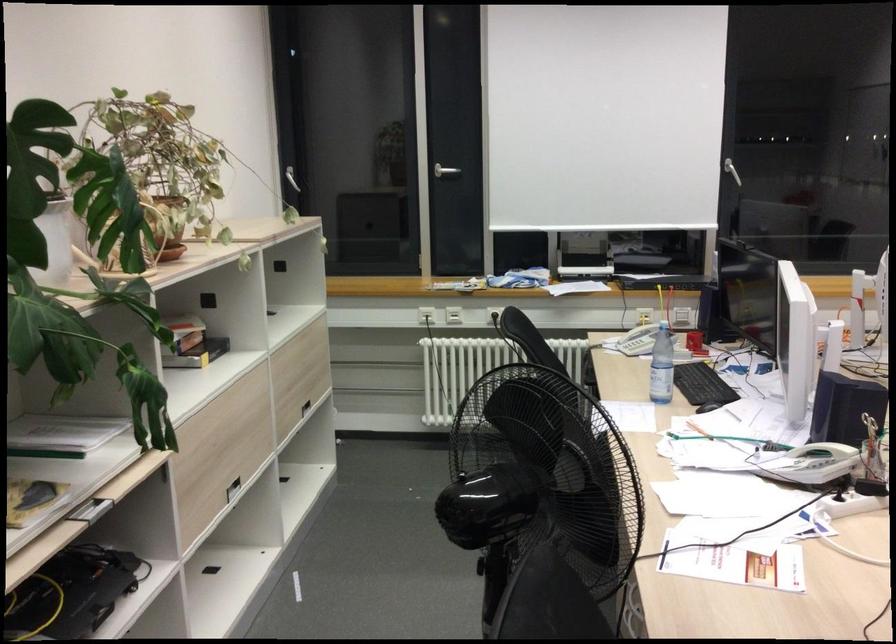
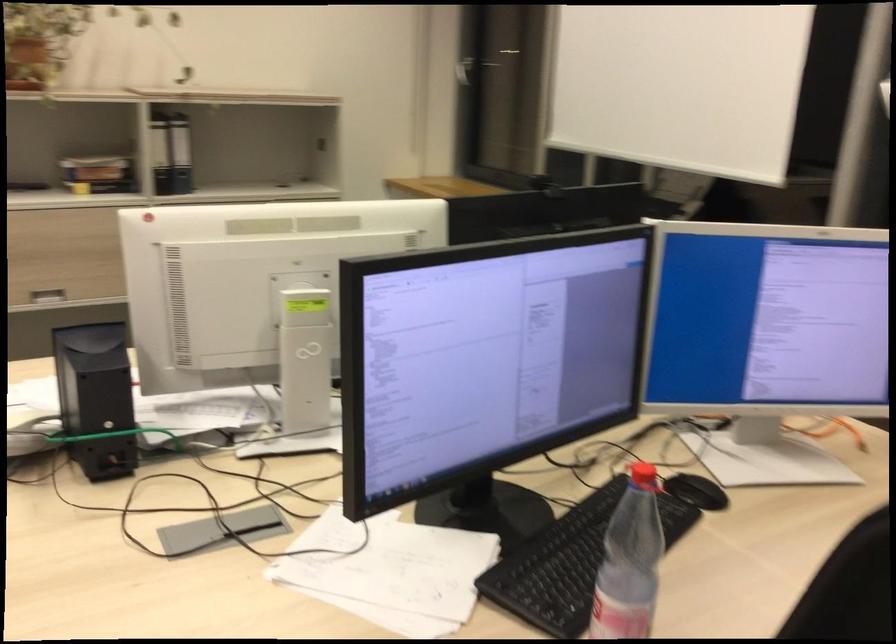
Question: I am providing you with two images of the same scene from different viewpoints. Which of the following objects are not visible in image2?

Choices:
 (A) silver cabinet handle
 (B) red handled switch
 (C) silver door handle
 (D) black speaker

Answer: (C)